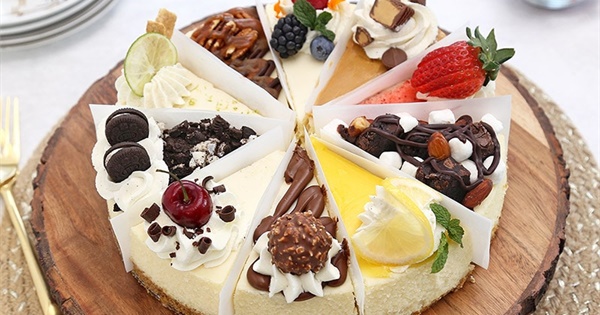
At what (x,y) coordinates should I click in order to perform the action: click on plates. Please return your answer as a coordinate pair (x, y). This screenshot has width=600, height=315. Looking at the image, I should click on (42, 11), (44, 21), (50, 30), (55, 37).